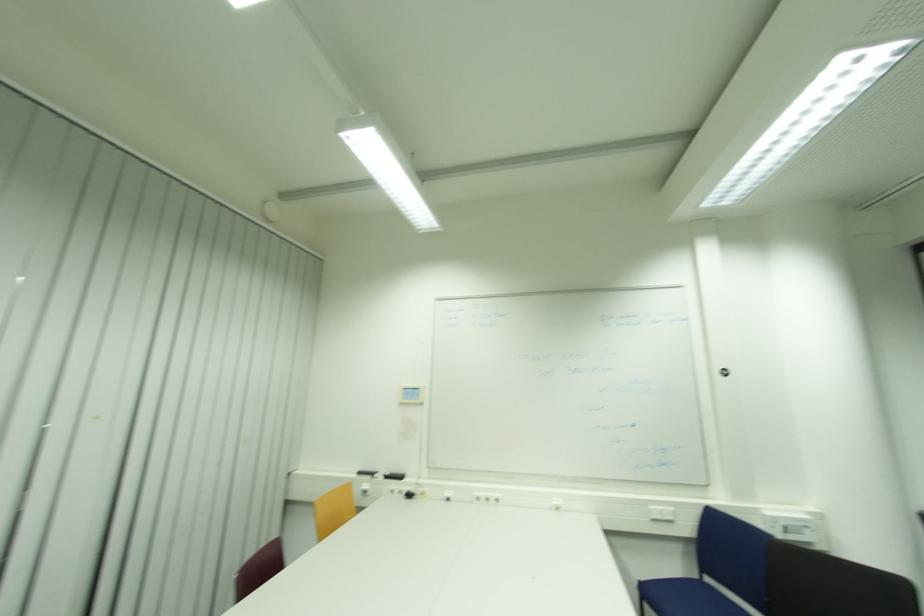
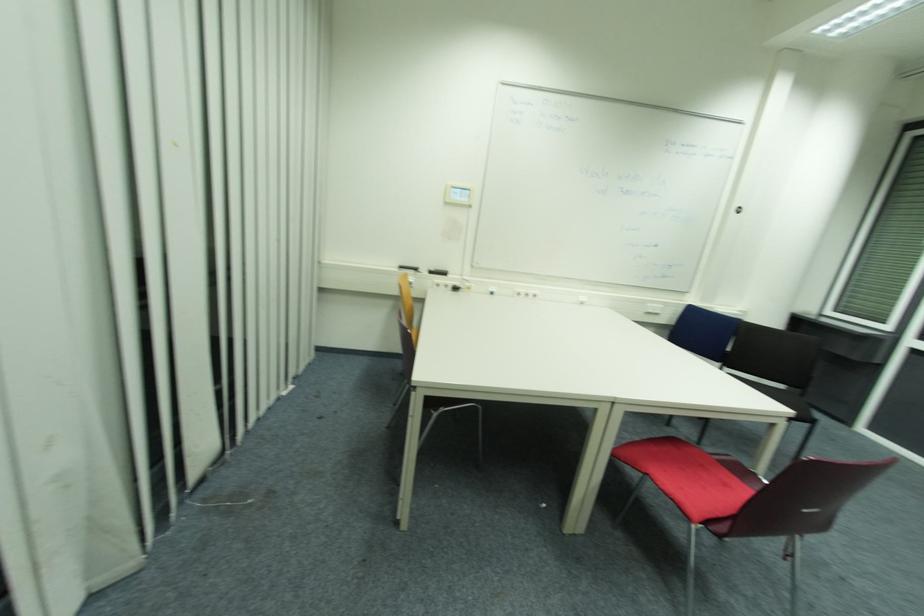
Find the pixel in the second image that matches (492,500) in the first image.

(529, 294)